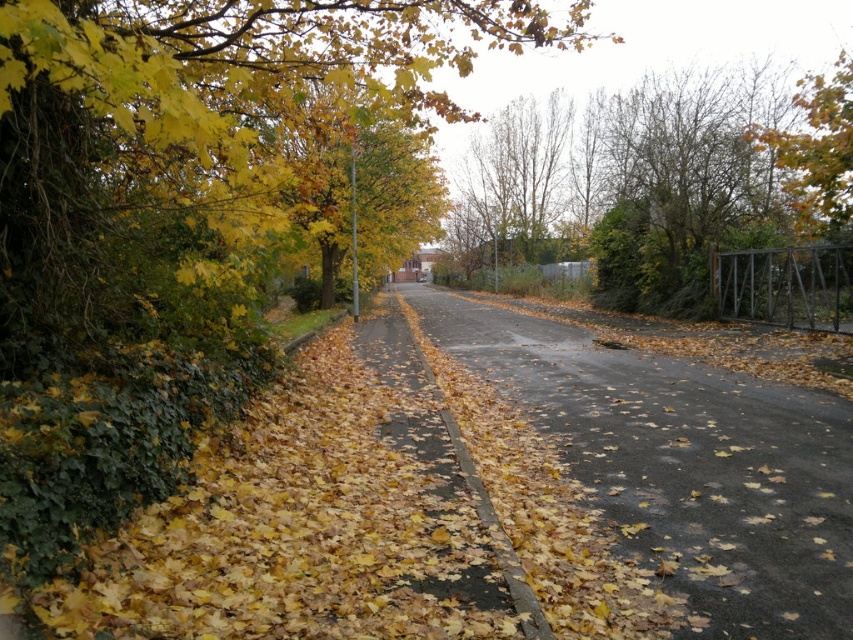
You are a delivery robot that is 1.5 meters wide. You need to move from the green leafy tree at left to the lamppost near the center. Can you fit through the space between them?

The distance between the green leafy tree at left and the lamppost near the center is 2.91 meters. Since the robot is 1.5 meters wide, it can easily pass through the space between them as there is sufficient clearance.

You are standing at the point labeled point (41, 208) and want to walk towards the point labeled point (614, 148). Given that both points are on the road, which direction should you face to move towards the second point?

You should face towards the upper right direction because point (614, 148) is located above and to the right of point (41, 208).

You are a bird looking for a higher perch. You see the green leafy tree at left and the green leafy tree at upper right. Which tree should you choose to get a higher vantage point?

The green leafy tree at left is much taller than the green leafy tree at upper right, so you should choose the green leafy tree at left to get a higher vantage point.